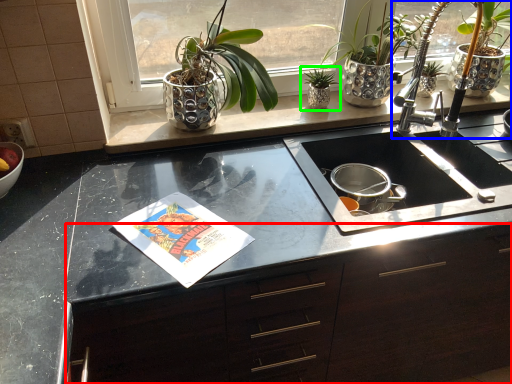
Question: Considering the real-world distances, which object is farthest from cabinetry (highlighted by a red box)? tap (highlighted by a blue box) or houseplant (highlighted by a green box)?

Choices:
 (A) tap
 (B) houseplant

Answer: (B)